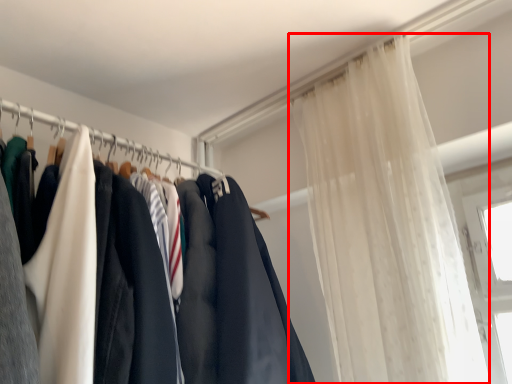
Question: Where is curtain (annotated by the red box) located in relation to clothesline in the image?

Choices:
 (A) right
 (B) left

Answer: (A)